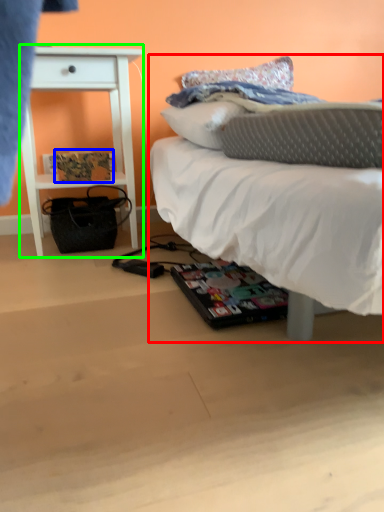
Question: Which is farther away from bed (highlighted by a red box)? magazine (highlighted by a blue box) or nightstand (highlighted by a green box)?

Choices:
 (A) magazine
 (B) nightstand

Answer: (A)